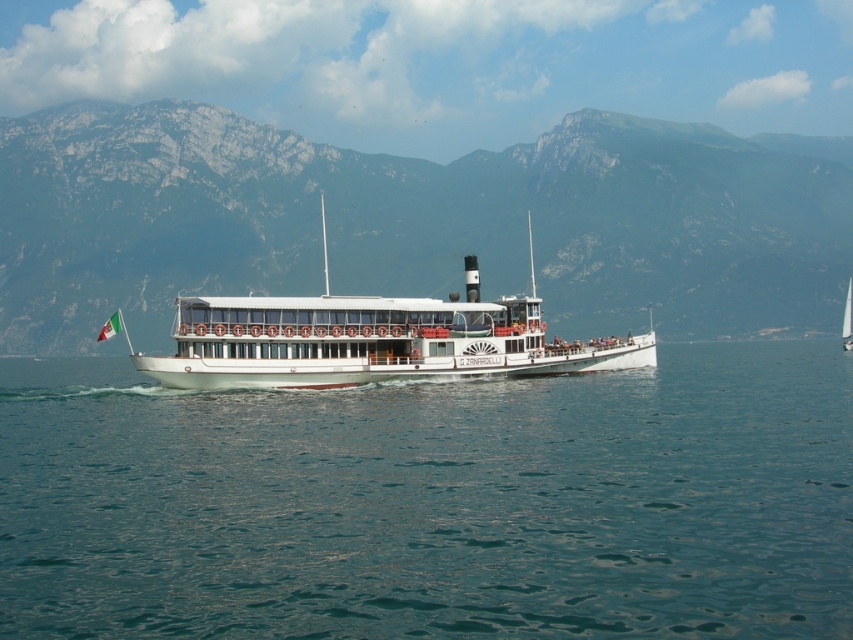
You are a passenger on the white polished wood boat at center and want to see the clear blue water at center. In which direction should you look from your position on the boat?

You should look downward from the white polished wood boat at center to see the clear blue water at center since it is located below the boat.

You are a tour guide on the G. Zanardelli steamer. You want to inform your passengers about the distance between the clear blue water at center and the green rocky mountain at center. What would you say?

The clear blue water at center is 232.54 meters away from the green rocky mountain at center.